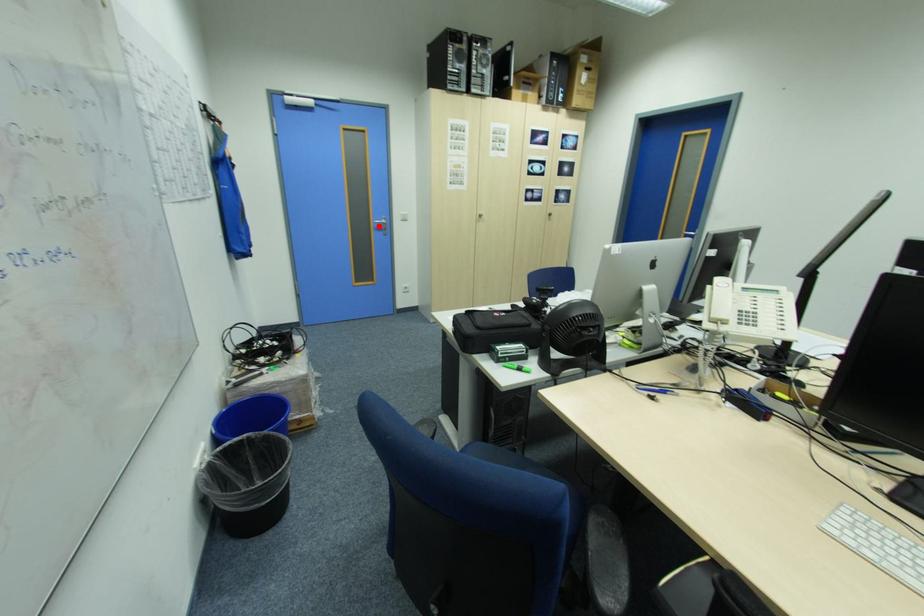
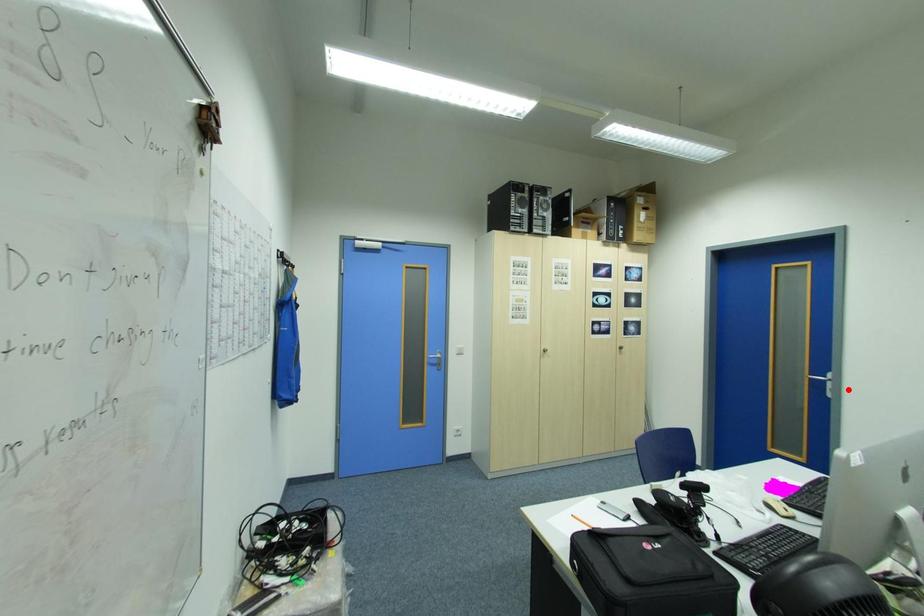
I am providing you with two images of the same scene from different viewpoints. A red point is marked on the first image and another point is marked on the second image. Are the points marked in image1 and image2 representing the same 3D position?

No